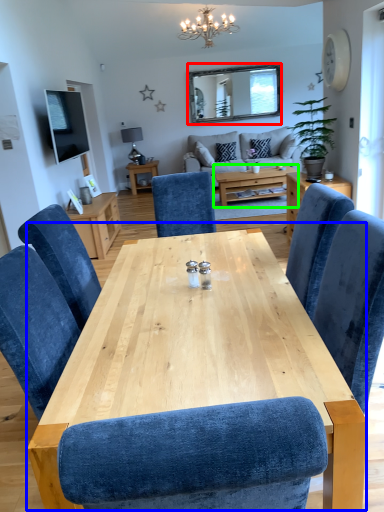
Question: Estimate the real-world distances between objects in this image. Which object is closer to mirror (highlighted by a red box), table (highlighted by a blue box) or coffee table (highlighted by a green box)?

Choices:
 (A) table
 (B) coffee table

Answer: (B)